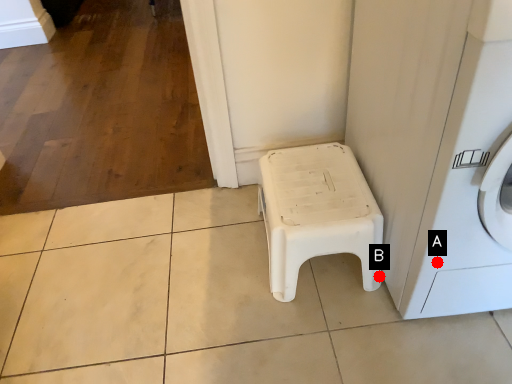
Question: Two points are circled on the image, labeled by A and B beside each circle. Which point is farther to the camera?

Choices:
 (A) A is further
 (B) B is further

Answer: (B)